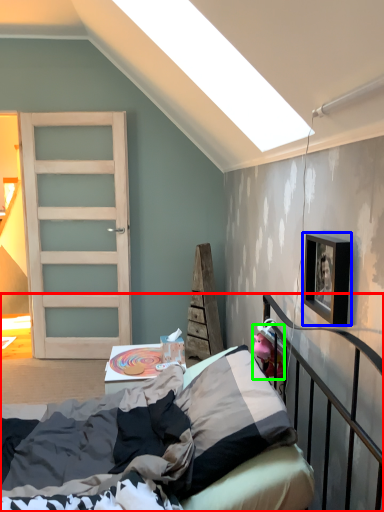
Question: Based on their relative distances, which object is nearer to bed (highlighted by a red box)? Choose from picture frame (highlighted by a blue box) and toy (highlighted by a green box).

Choices:
 (A) picture frame
 (B) toy

Answer: (B)